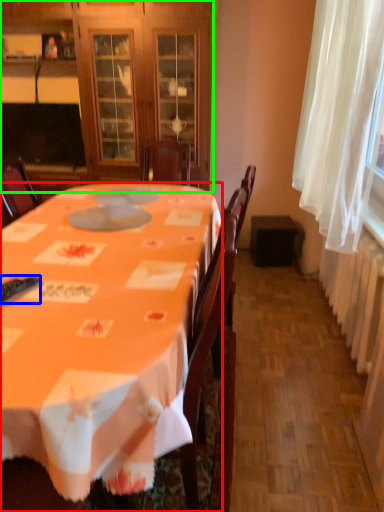
Question: Considering the real-world distances, which object is farthest from desk (highlighted by a red box)? remote control (highlighted by a blue box) or cabinetry (highlighted by a green box)?

Choices:
 (A) remote control
 (B) cabinetry

Answer: (B)